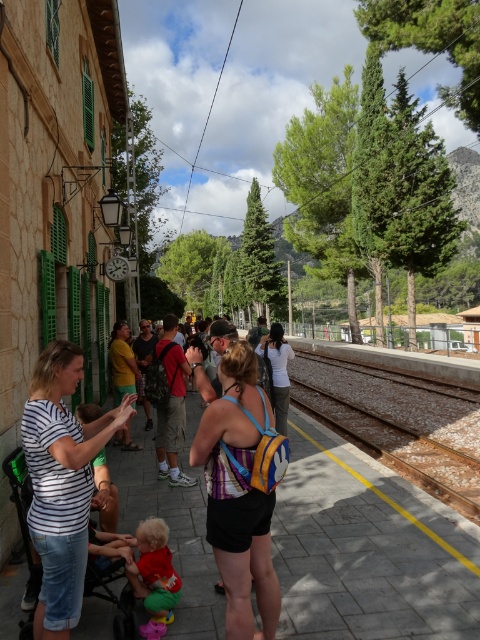
You are a photographer standing on the train station platform. You notice a person wearing a white cotton shirt at center and another wearing camouflage shorts at center. Which clothing item is positioned to the right?

The white cotton shirt at center is to the right of camouflage shorts at center.

You are a fashion designer observing a crowd at a train station. You notice two shirts in the crowd, a striped cotton shirt at center and a white cotton shirt at center. Which shirt is positioned lower in the scene?

The striped cotton shirt at center is positioned below the white cotton shirt at center, so the striped cotton shirt at center is lower in the scene.

Where is the striped cotton shirt at center located in the image?

The striped cotton shirt at center is located at point (x=61, y=483) in the image.